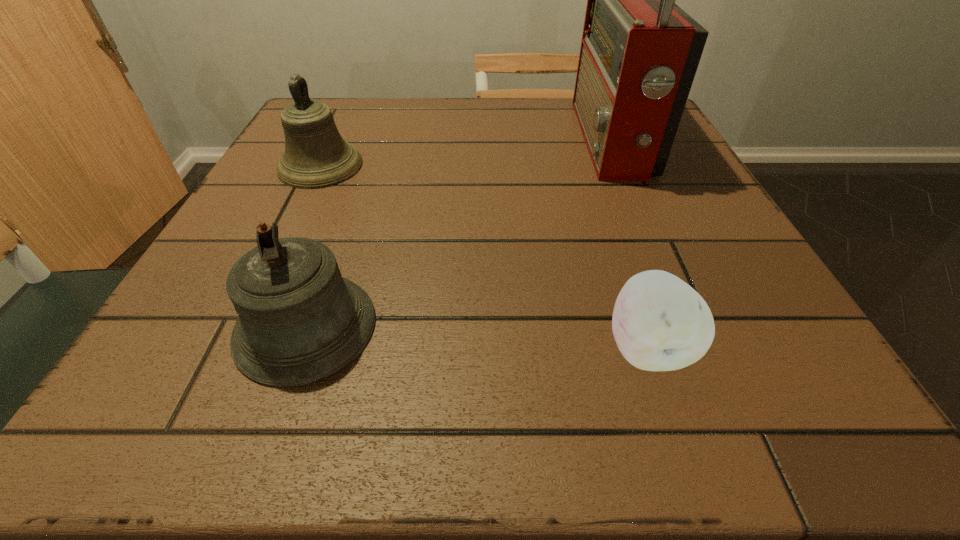
This screenshot has height=540, width=960. In order to click on vacant area that lies between the radio receiver and the apple in this screenshot , I will do `click(629, 244)`.

You are a GUI agent. You are given a task and a screenshot of the screen. Output one action in this format:
    pyautogui.click(x=<x>, y=<y>)
    Task: Click on the object that is the nearest to the nearer bell
    The height and width of the screenshot is (540, 960).
    Given the screenshot: What is the action you would take?
    pyautogui.click(x=316, y=156)

Where is `the closest object to the apple`? The image size is (960, 540). the closest object to the apple is located at coordinates (299, 321).

The height and width of the screenshot is (540, 960). What are the coordinates of `free space that satisfies the following two spatial constraints: 1. on the front-facing side of the radio receiver; 2. on the front side of the shortest object` in the screenshot? It's located at (699, 348).

At what (x,y) coordinates should I click in order to perform the action: click on free location that satisfies the following two spatial constraints: 1. on the front-facing side of the radio receiver; 2. on the front side of the apple. Please return your answer as a coordinate pair (x, y). Looking at the image, I should click on (699, 348).

The height and width of the screenshot is (540, 960). Identify the location of vacant space that satisfies the following two spatial constraints: 1. on the front side of the farther bell; 2. on the right side of the apple. (232, 348).